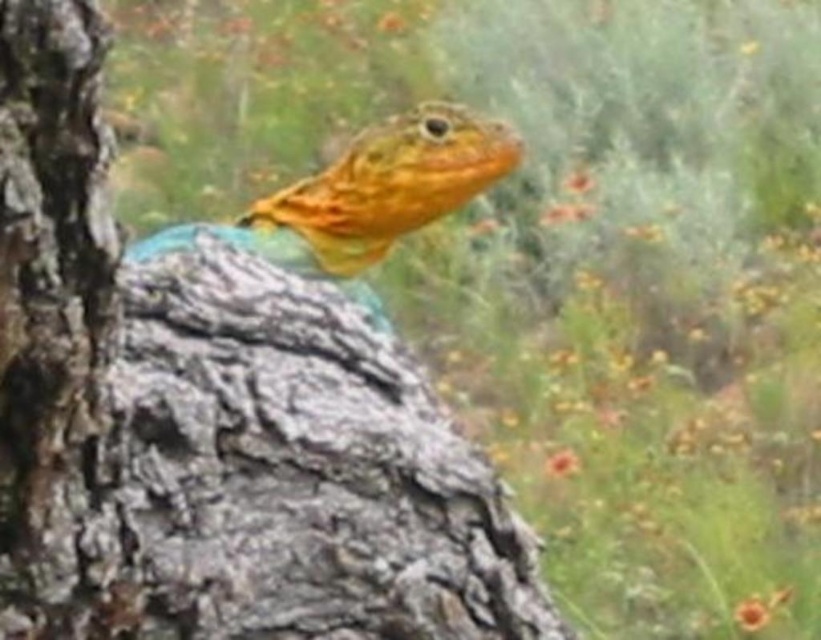
Question: In this image, where is smooth bark tree trunk at center located relative to shiny orange lizard at center?

Choices:
 (A) above
 (B) below

Answer: (B)

Question: Among these objects, which one is nearest to the camera?

Choices:
 (A) smooth bark tree trunk at center
 (B) shiny orange lizard at center

Answer: (A)

Question: Among these points, which one is farthest from the camera?

Choices:
 (A) (388, 323)
 (B) (429, 496)

Answer: (A)

Question: Can you confirm if smooth bark tree trunk at center is thinner than shiny orange lizard at center?

Choices:
 (A) no
 (B) yes

Answer: (B)

Question: Does smooth bark tree trunk at center appear over shiny orange lizard at center?

Choices:
 (A) no
 (B) yes

Answer: (A)